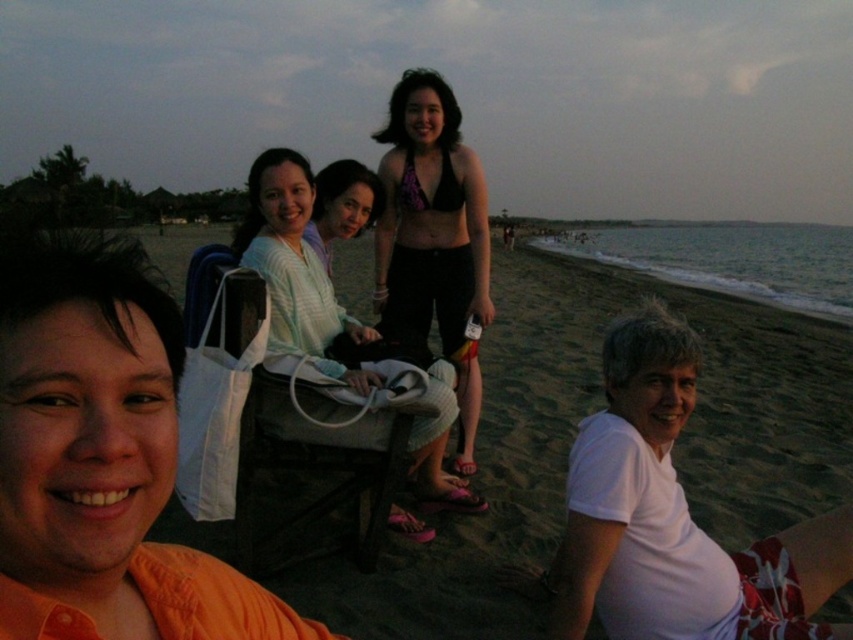
You are a photographer trying to capture a photo of the purple fabric bikini top at center and the light blue striped shirt at center. Which object should you focus on first to ensure it appears sharp in the photo?

The purple fabric bikini top at center is further to the viewer than the light blue striped shirt at center, so you should focus on the purple fabric bikini top at center first to ensure it appears sharp.

You are standing at the edge of the beach and want to place a small flag exactly where the beige sand at lower center is. According to the coordinates provided, where should you place the flag?

The beige sand at lower center is located at point (x=573, y=433), so you should place the flag at those coordinates.